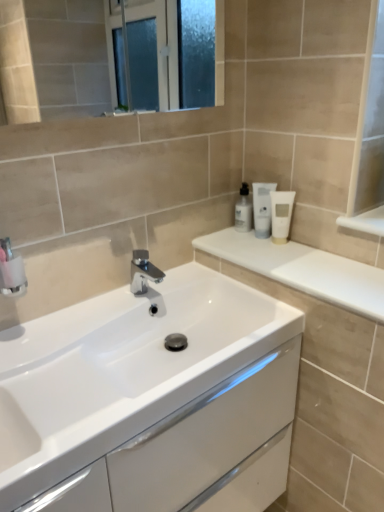
Question: In terms of width, does white glossy cabinet at center look wider or thinner when compared to white glossy lotion at upper right, the 3th toiletry in the right-to-left sequence?

Choices:
 (A) wide
 (B) thin

Answer: (A)

Question: Does point (213, 422) appear closer or farther from the camera than point (249, 216)?

Choices:
 (A) closer
 (B) farther

Answer: (A)

Question: Which object is the closest to the white glossy lotion at upper right, arranged as the first toiletry when viewed from the left?

Choices:
 (A) chrome metallic faucet at center
 (B) white glossy cabinet at center
 (C) white matte tube at upper right, which is the second toiletry in left-to-right order
 (D) white matte tube at upper right, which is the 1th toiletry in right-to-left order
 (E) white glossy countertop at upper right

Answer: (C)

Question: Estimate the real-world distances between objects in this image. Which object is farther from the white glossy cabinet at center?

Choices:
 (A) white matte tube at upper right, which is the second toiletry in left-to-right order
 (B) white glossy countertop at upper right
 (C) white matte tube at upper right, which is the 3th toiletry in left-to-right order
 (D) white glossy lotion at upper right, the 3th toiletry in the right-to-left sequence
 (E) chrome metallic faucet at center

Answer: (D)